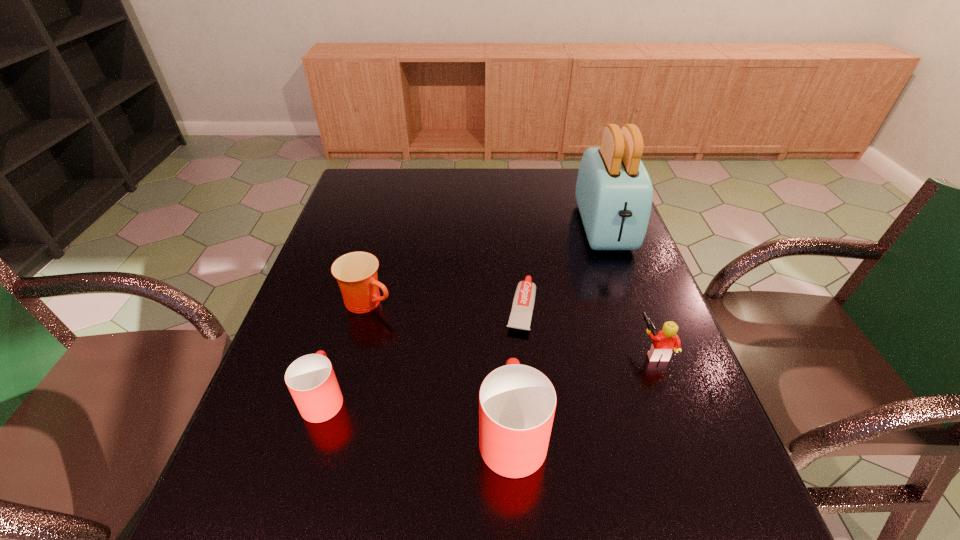
This screenshot has width=960, height=540. Find the location of `free point that keeps the cups evenly spaced on the right`. free point that keeps the cups evenly spaced on the right is located at coordinates (728, 472).